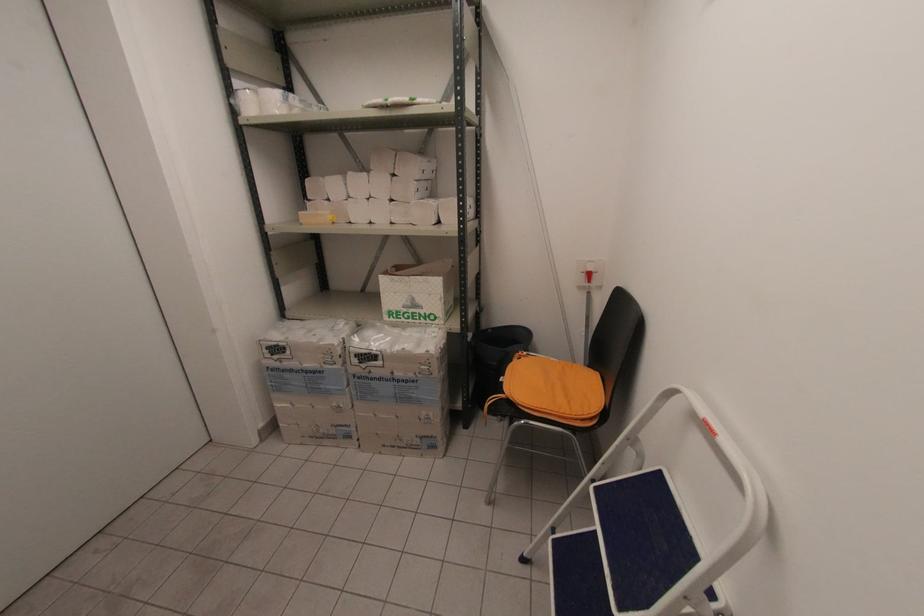
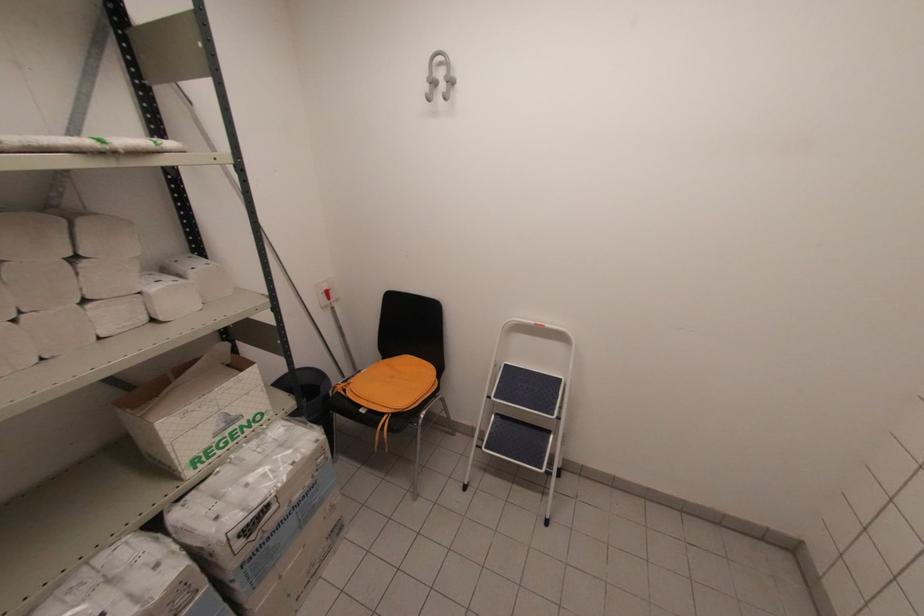
Locate, in the second image, the point that corresponds to the point at 372,379 in the first image.

(271, 539)